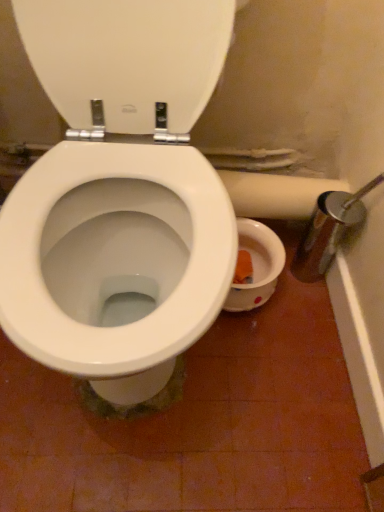
Find the location of `vacant space situated above white matte toilet paper at right (from a real-world perspective)`. vacant space situated above white matte toilet paper at right (from a real-world perspective) is located at coordinates (275, 180).